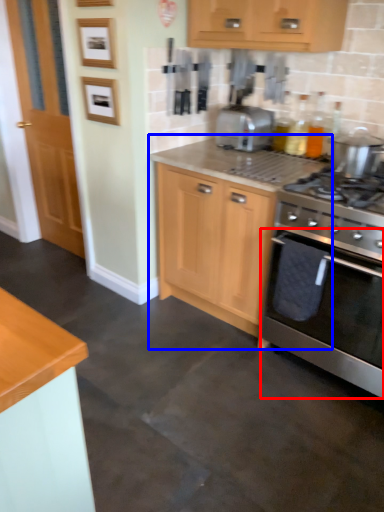
Question: Which of the following is the farthest to the observer, oven (highlighted by a red box) or cabinetry (highlighted by a blue box)?

Choices:
 (A) oven
 (B) cabinetry

Answer: (B)